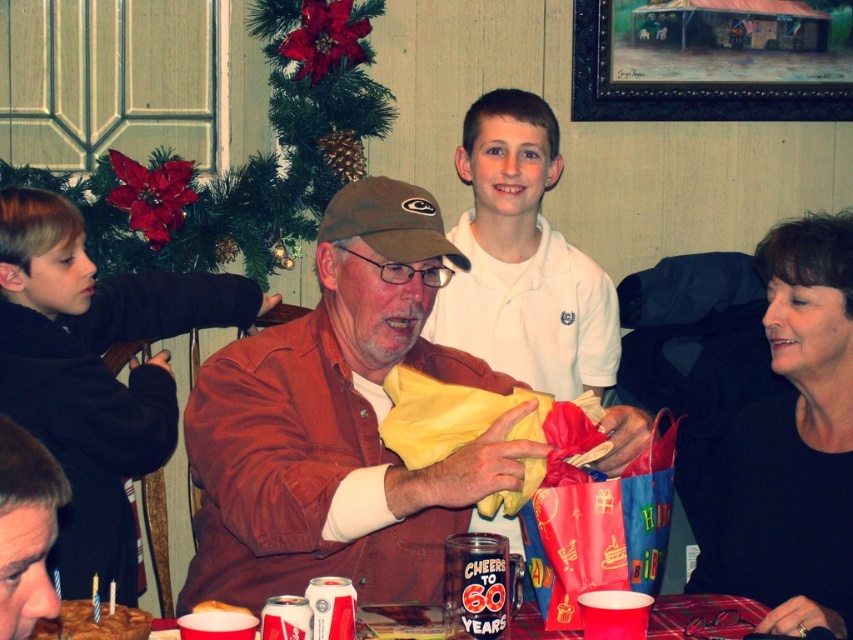
Question: Among these points, which one is farthest from the camera?

Choices:
 (A) (7, 342)
 (B) (61, 470)
 (C) (538, 209)
 (D) (415, 276)

Answer: (C)

Question: Can you confirm if white smooth shirt at upper center is wider than smooth brown leather jacket at lower left?

Choices:
 (A) yes
 (B) no

Answer: (A)

Question: Is white smooth shirt at upper center closer to camera compared to chocolate cake with frosting at lower left?

Choices:
 (A) no
 (B) yes

Answer: (A)

Question: Which of the following is the farthest from the observer?

Choices:
 (A) tap(57, 630)
 (B) tap(231, 483)
 (C) tap(38, 577)
 (D) tap(456, 227)

Answer: (D)

Question: Can you confirm if black fleece jacket at left is positioned to the left of white smooth shirt at upper center?

Choices:
 (A) yes
 (B) no

Answer: (A)

Question: Considering the real-world distances, which object is farthest from the white smooth shirt at upper center?

Choices:
 (A) chocolate cake with frosting at lower left
 (B) black fleece jacket at left

Answer: (A)